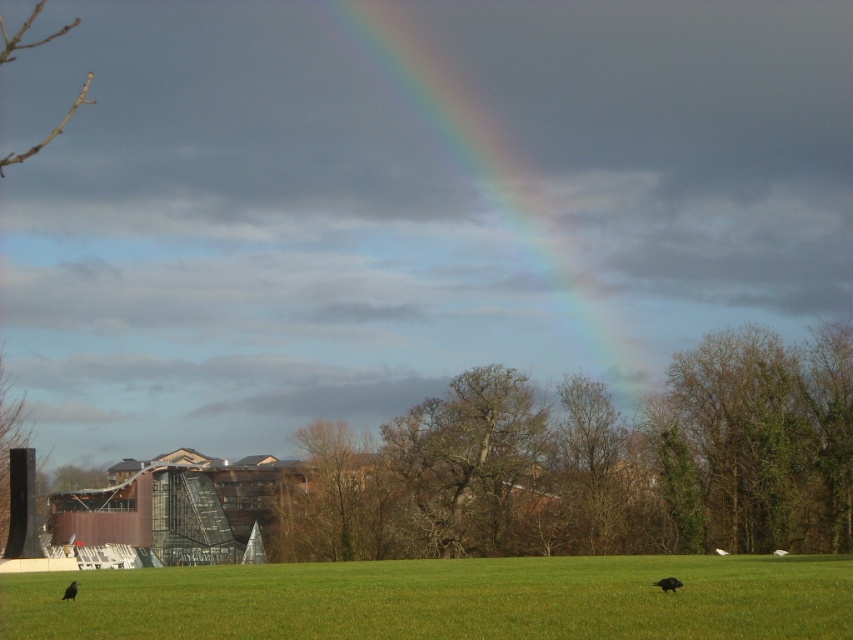
Is green grass at lower center bigger than shiny black bird at lower right?

Yes.

Does green grass at lower center appear under shiny black bird at lower right?

Indeed, green grass at lower center is positioned under shiny black bird at lower right.

Which is in front, point (599, 557) or point (680, 586)?

Point (680, 586) is more forward.

Locate an element on the screen. green grass at lower center is located at coordinates (444, 600).

Can you confirm if brown leafless tree at center is positioned above rainbow at upper center?

Actually, brown leafless tree at center is below rainbow at upper center.

Who is more forward, (773, 499) or (573, 280)?

Point (773, 499) is in front.

The image size is (853, 640). In order to click on brown leafless tree at center in this screenshot , I will do `click(599, 464)`.

Does point (503, 225) come closer to viewer compared to point (67, 596)?

No, (503, 225) is behind (67, 596).

Who is more distant from viewer, (637, 172) or (74, 586)?

Positioned behind is point (637, 172).

Is point (583, 289) less distant than point (73, 589)?

No, it is behind (73, 589).

Locate an element on the screen. rainbow at upper center is located at coordinates (535, 173).